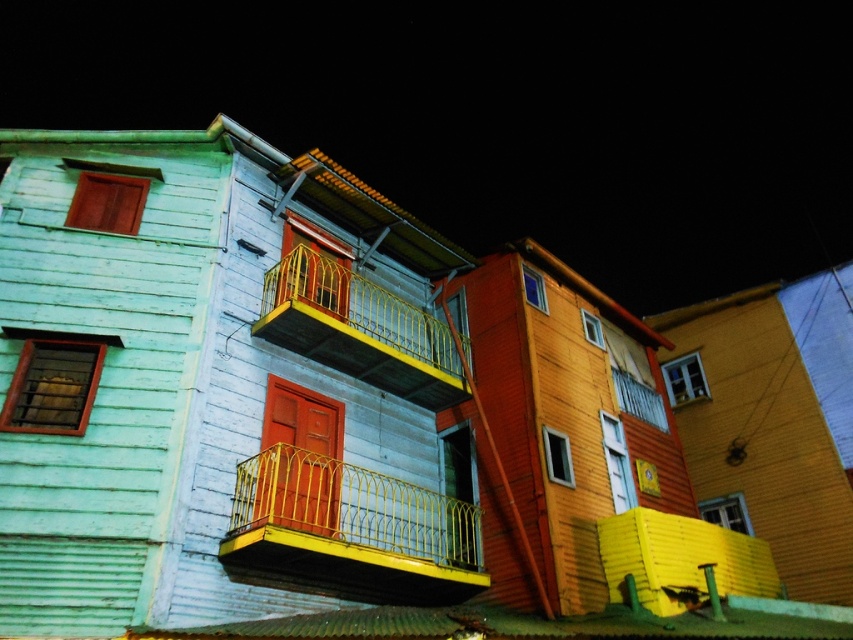
Can you confirm if wooden balcony at center is positioned below yellow metallic balcony at center?

No.

In the scene shown: Who is higher up, wooden balcony at center or yellow metallic balcony at center?

Positioned higher is wooden balcony at center.

Where is `wooden balcony at center`? wooden balcony at center is located at coordinates pyautogui.click(x=502, y=115).

Consider the image. Which is more to the right, yellow metallic balcony at center or yellow metal railing at upper center?

yellow metallic balcony at center

Who is more forward, [430,540] or [335,282]?

Point [430,540] is more forward.

Which is in front, point (360, 529) or point (364, 323)?

Point (360, 529)

You are a GUI agent. You are given a task and a screenshot of the screen. Output one action in this format:
    pyautogui.click(x=<x>, y=<y>)
    Task: Click on the yellow metallic balcony at center
    The height and width of the screenshot is (640, 853).
    Given the screenshot: What is the action you would take?
    pyautogui.click(x=350, y=531)

Who is lower down, wooden balcony at center or yellow metal railing at upper center?

yellow metal railing at upper center is lower down.

Is point (790, 148) positioned after point (325, 330)?

Yes, it is behind point (325, 330).

Image resolution: width=853 pixels, height=640 pixels. Identify the location of wooden balcony at center. (502, 115).